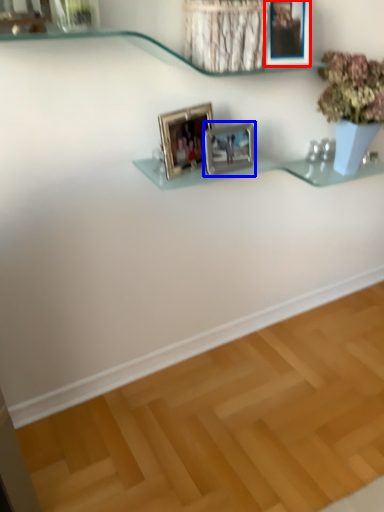
Question: Which of the following is the farthest to the observer, picture frame (highlighted by a red box) or picture frame (highlighted by a blue box)?

Choices:
 (A) picture frame
 (B) picture frame

Answer: (B)